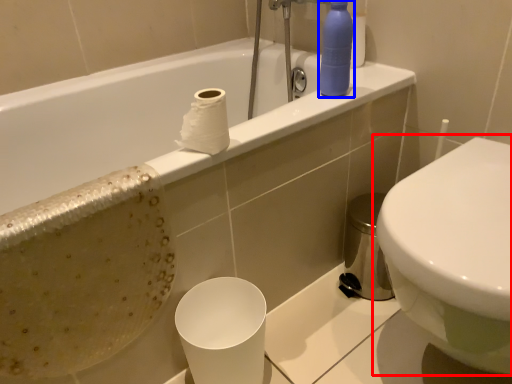
Question: Among these objects, which one is nearest to the camera, toilet (highlighted by a red box) or cleaning product (highlighted by a blue box)?

Choices:
 (A) toilet
 (B) cleaning product

Answer: (A)